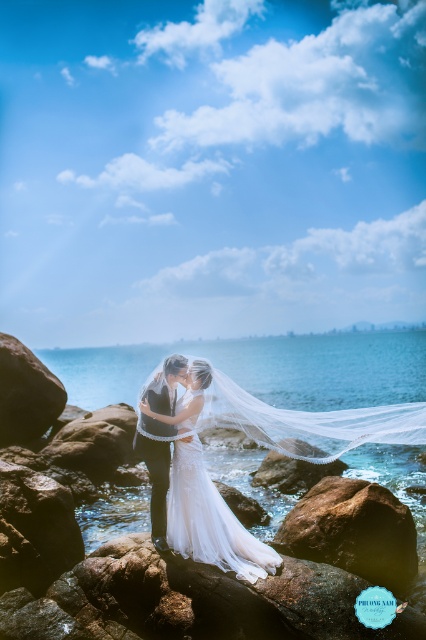
Question: Considering the relative positions of white lace dress at center and white glossy stone at center in the image provided, where is white lace dress at center located with respect to white glossy stone at center?

Choices:
 (A) left
 (B) right

Answer: (A)

Question: Which point appears closest to the camera in this image?

Choices:
 (A) (302, 364)
 (B) (293, 512)
 (C) (313, 464)
 (D) (192, 515)

Answer: (D)

Question: Considering the real-world distances, which object is farthest from the white glossy stone at center?

Choices:
 (A) white lace dress at center
 (B) clear blue water at center
 (C) brown rough rock at lower center

Answer: (B)

Question: Is clear blue water at center wider than white lace dress at center?

Choices:
 (A) no
 (B) yes

Answer: (B)

Question: In this image, where is brown rough rock at lower center located relative to white glossy stone at center?

Choices:
 (A) right
 (B) left

Answer: (A)

Question: Among these objects, which one is farthest from the camera?

Choices:
 (A) white glossy stone at center
 (B) brown rough rock at lower center
 (C) clear blue water at center
 (D) white lace dress at center

Answer: (A)